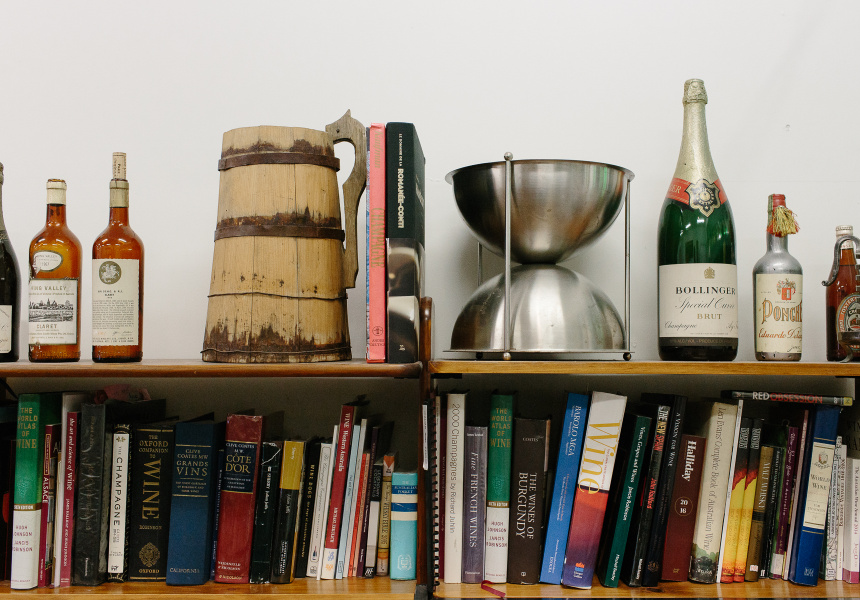
Where is `amber bottle with white cap`? amber bottle with white cap is located at coordinates (65, 260).